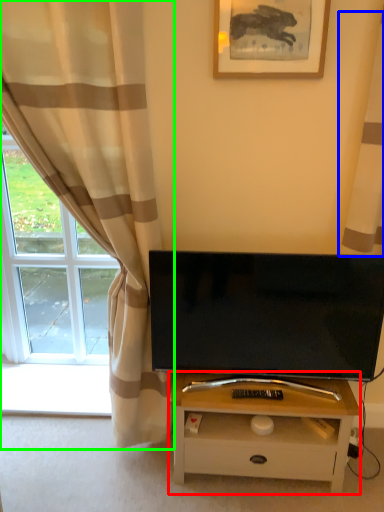
Question: Which object is positioned closest to table (highlighted by a red box)? Select from curtain (highlighted by a blue box) and curtain (highlighted by a green box).

Choices:
 (A) curtain
 (B) curtain

Answer: (B)